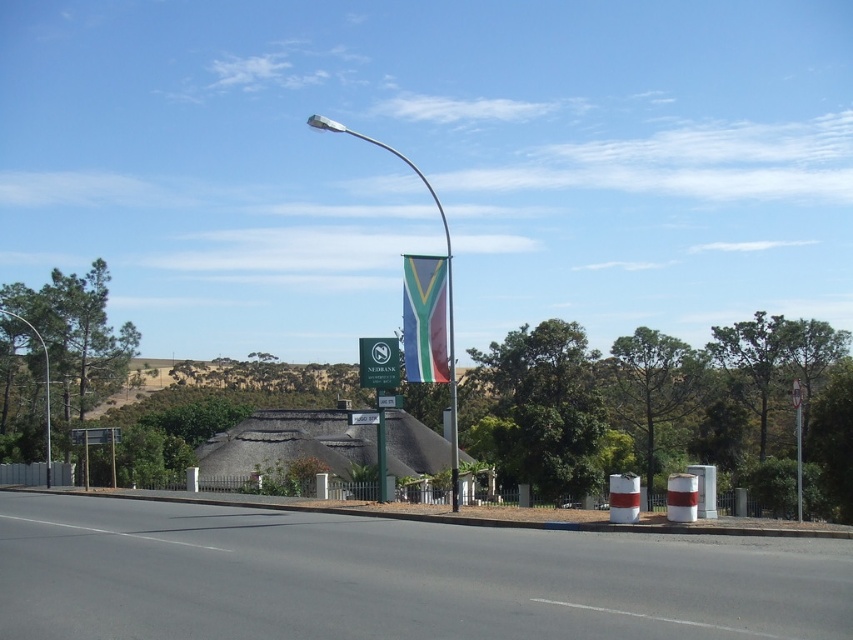
Does white plastic sign at center have a greater width compared to green plastic street sign at center?

Indeed, white plastic sign at center has a greater width compared to green plastic street sign at center.

Is point (358, 412) less distant than point (398, 397)?

That is True.

In order to click on white plastic sign at center in this screenshot , I will do `click(363, 417)`.

Does metallic pole at center have a greater height compared to green plastic street sign at center?

Correct, metallic pole at center is much taller as green plastic street sign at center.

Does metallic pole at center appear on the right side of green plastic street sign at center?

In fact, metallic pole at center is to the left of green plastic street sign at center.

The image size is (853, 640). What are the coordinates of `metallic pole at center` in the screenshot? It's located at (439, 298).

Based on the photo, can you confirm if metallic pole at center is positioned to the right of metallic pole at left?

Indeed, metallic pole at center is positioned on the right side of metallic pole at left.

Can you confirm if metallic pole at center is wider than metallic pole at left?

Indeed, metallic pole at center has a greater width compared to metallic pole at left.

Who is more distant from viewer, (x=453, y=477) or (x=45, y=474)?

The point (x=45, y=474) is more distant.

Where is `metallic pole at center`? metallic pole at center is located at coordinates (439, 298).